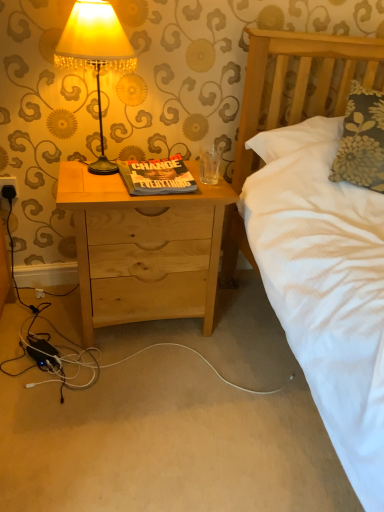
The image size is (384, 512). What are the coordinates of `free spot above natural wood nightstand at center (from a real-world perspective)` in the screenshot? It's located at (154, 183).